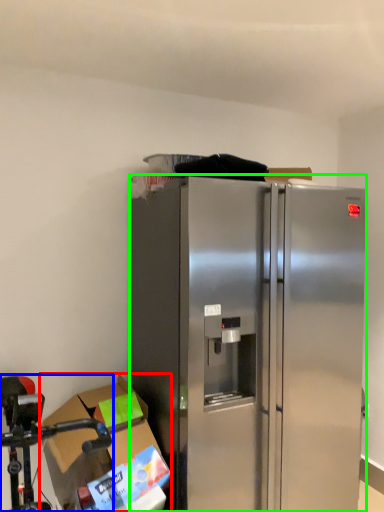
Question: Which object is positioned closest to cardboard box (highlighted by a red box)? Select from stainless steel (highlighted by a blue box) and refrigerator (highlighted by a green box).

Choices:
 (A) stainless steel
 (B) refrigerator

Answer: (A)